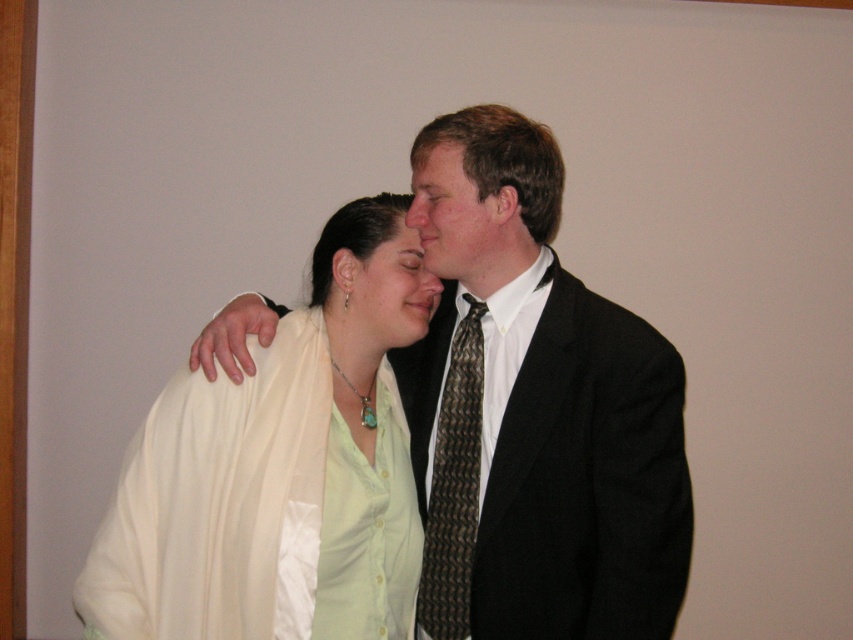
Can you confirm if matte green shirt at center is positioned to the right of matte black hair at center?

No, matte green shirt at center is not to the right of matte black hair at center.

I want to click on matte green shirt at center, so click(x=386, y=292).

Image resolution: width=853 pixels, height=640 pixels. In order to click on matte green shirt at center in this screenshot , I will do `click(386, 292)`.

Which is in front, point (668, 531) or point (428, 556)?

Point (668, 531)

Image resolution: width=853 pixels, height=640 pixels. Find the location of `black textured suit at center`. black textured suit at center is located at coordinates (543, 432).

Does matte black suit at center have a lesser width compared to matte black hair at center?

Incorrect, matte black suit at center's width is not less than matte black hair at center's.

Who is taller, matte black suit at center or matte black hair at center?

matte black suit at center

Locate an element on the screen. The image size is (853, 640). matte black suit at center is located at coordinates (461, 221).

You are a GUI agent. You are given a task and a screenshot of the screen. Output one action in this format:
    pyautogui.click(x=<x>, y=<y>)
    Task: Click on the matte black suit at center
    The width and height of the screenshot is (853, 640).
    Given the screenshot: What is the action you would take?
    pyautogui.click(x=461, y=221)